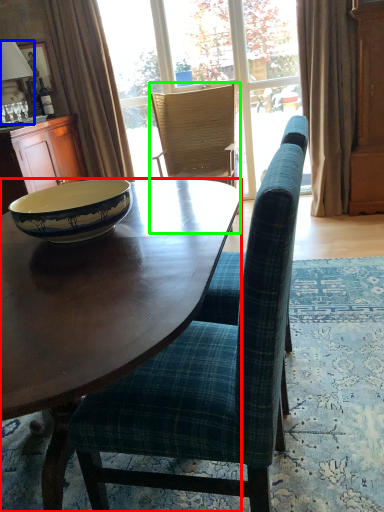
Question: Which is farther away from desk (highlighted by a red box)? lamp (highlighted by a blue box) or chair (highlighted by a green box)?

Choices:
 (A) lamp
 (B) chair

Answer: (A)